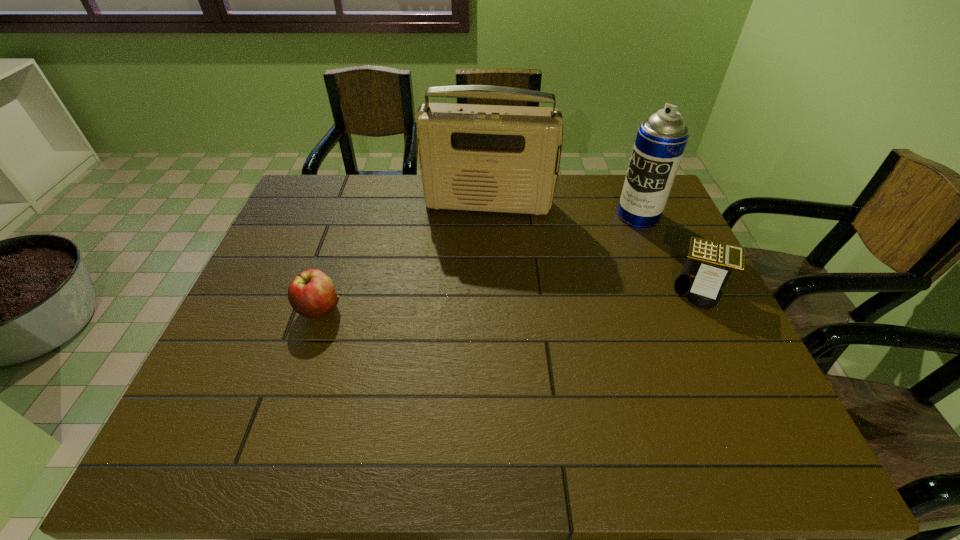
Find the location of `vacant space in between the radio receiver and the leftmost object`. vacant space in between the radio receiver and the leftmost object is located at coordinates (404, 256).

Find the location of a particular element. vacant space that is in between the aerosol can and the apple is located at coordinates (479, 262).

Locate an element on the screen. The height and width of the screenshot is (540, 960). free point between the apple and the aerosol can is located at coordinates (479, 262).

Locate an element on the screen. The height and width of the screenshot is (540, 960). unoccupied position between the leftmost object and the radio receiver is located at coordinates (404, 256).

I want to click on the third closest object relative to the third object from right to left, so click(x=311, y=293).

Find the location of a particular element. The image size is (960, 540). object that can be found as the closest to the aerosol can is located at coordinates (x=709, y=264).

At what (x,y) coordinates should I click in order to perform the action: click on vacant region that satisfies the following two spatial constraints: 1. on the front side of the third object from right to left; 2. on the left side of the aerosol can. Please return your answer as a coordinate pair (x, y). Image resolution: width=960 pixels, height=540 pixels. Looking at the image, I should click on (489, 215).

The height and width of the screenshot is (540, 960). In order to click on free region that satisfies the following two spatial constraints: 1. on the back side of the calculator; 2. on the right side of the apple in this screenshot , I will do `click(327, 288)`.

Find the location of `vacant space that satisfies the following two spatial constraints: 1. on the front side of the calculator; 2. on the right side of the aerosol can`. vacant space that satisfies the following two spatial constraints: 1. on the front side of the calculator; 2. on the right side of the aerosol can is located at coordinates (668, 288).

This screenshot has width=960, height=540. What are the coordinates of `free spot that satisfies the following two spatial constraints: 1. on the front side of the radio receiver; 2. on the left side of the calculator` in the screenshot? It's located at (491, 288).